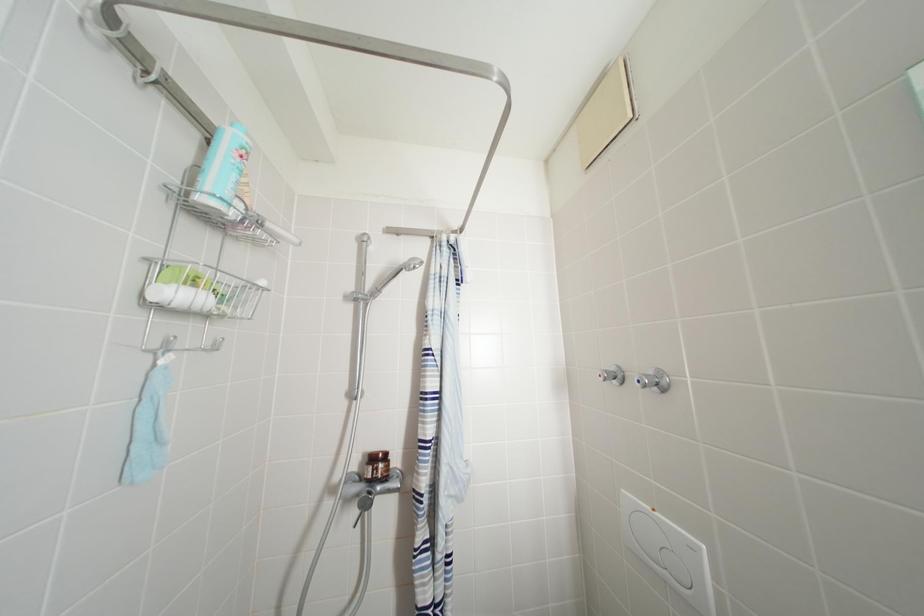
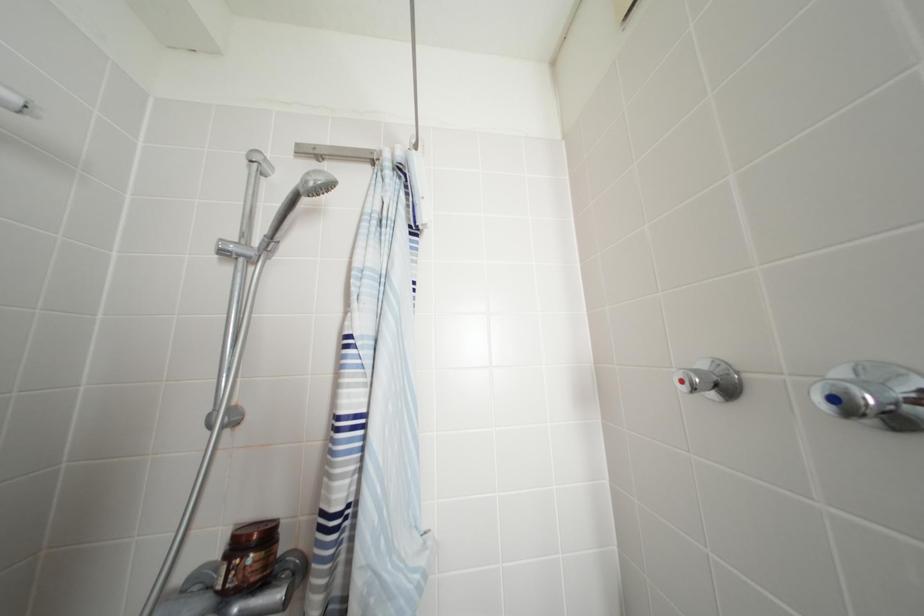
Question: The images are taken continuously from a first-person perspective. In which direction are you moving?

Choices:
 (A) Left
 (B) Right
 (C) Forward
 (D) Backward

Answer: (C)